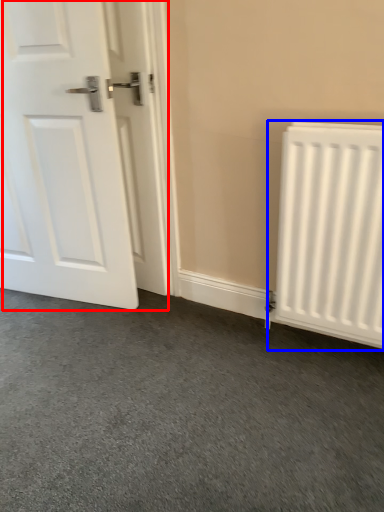
Question: Which of the following is the closest to the observer, door (highlighted by a red box) or radiator (highlighted by a blue box)?

Choices:
 (A) door
 (B) radiator

Answer: (B)